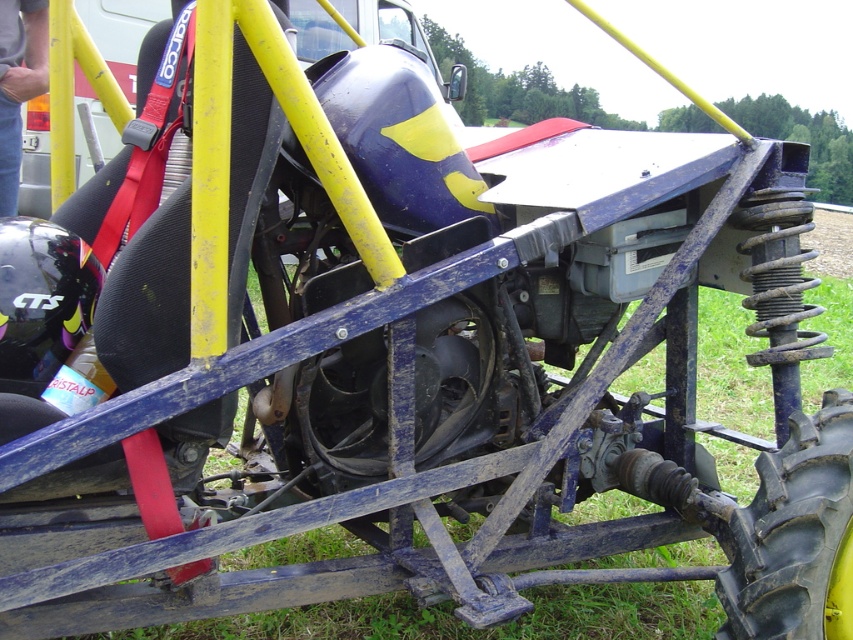
You are standing next to the off road vehicle and want to place a small tool kit on the ground near the green grass at lower center. According to the coordinates provided, where exactly should you place the tool kit?

The green grass at lower center is located at point (473, 628), so you should place the tool kit near that coordinate.

You are a mechanic working on the offroad vehicle. You need to access the suspension system on the right side of the frame. The green grass at lower center and the black rubber tire at lower right are in your way. Which object should you move first to get to the suspension system?

The green grass at lower center is positioned on the right side of black rubber tire at lower right. Since the suspension system is on the right side of the frame, you should move the black rubber tire at lower right first to access it.